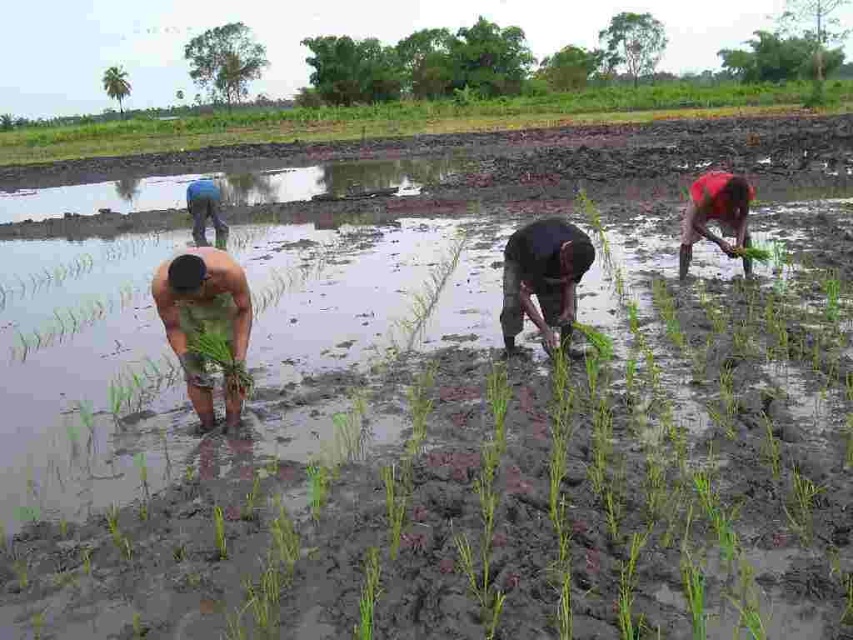
You are observing a rice paddy field from above. You notice a red matte shirt at right and a green leafy plant at lower left. Which object is taller?

The red matte shirt at right is taller than the green leafy plant at lower left.

You are a farmer observing the workers in the paddy field. Which worker has a shorter height between the dark brown skin at center and the blue fabric shirt at upper left?

The dark brown skin at center is shorter than the blue fabric shirt at upper left.

You are a farmer in the paddy field. You notice a green leafy plant at lower left and a blue fabric shirt at upper left. Which object is narrower in width?

The green leafy plant at lower left is thinner than the blue fabric shirt at upper left, so the green leafy plant at lower left is narrower in width.